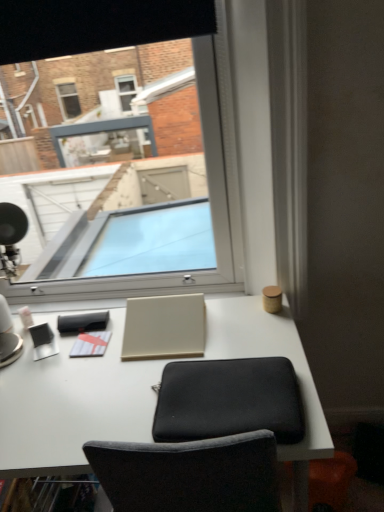
Question: Considering the positions of white matte notepad at center, which ranks as the 1th notepad in bottom-to-top order, and black fabric computer chair at center in the image, is white matte notepad at center, which ranks as the 1th notepad in bottom-to-top order, wider or thinner than black fabric computer chair at center?

Choices:
 (A) thin
 (B) wide

Answer: (A)

Question: From their relative heights in the image, would you say white matte notepad at center, positioned as the 1th notepad in front-to-back order, is taller or shorter than black fabric computer chair at center?

Choices:
 (A) tall
 (B) short

Answer: (B)

Question: Which object is the farthest from the white matte notepad at center, which ranks as the 2th notepad in top-to-bottom order?

Choices:
 (A) matte white notepad at center, the 1th notepad in the back-to-front sequence
 (B) beige matte laptop at center
 (C) black fabric computer chair at center
 (D) transparent glass window at center
 (E) white matte desk at center

Answer: (D)

Question: Which of these objects is positioned closest to the white matte desk at center?

Choices:
 (A) beige matte laptop at center
 (B) transparent glass window at center
 (C) matte white notepad at center, the 1th notepad in the back-to-front sequence
 (D) white matte notepad at center, which ranks as the 2th notepad in top-to-bottom order
 (E) black fabric computer chair at center

Answer: (A)